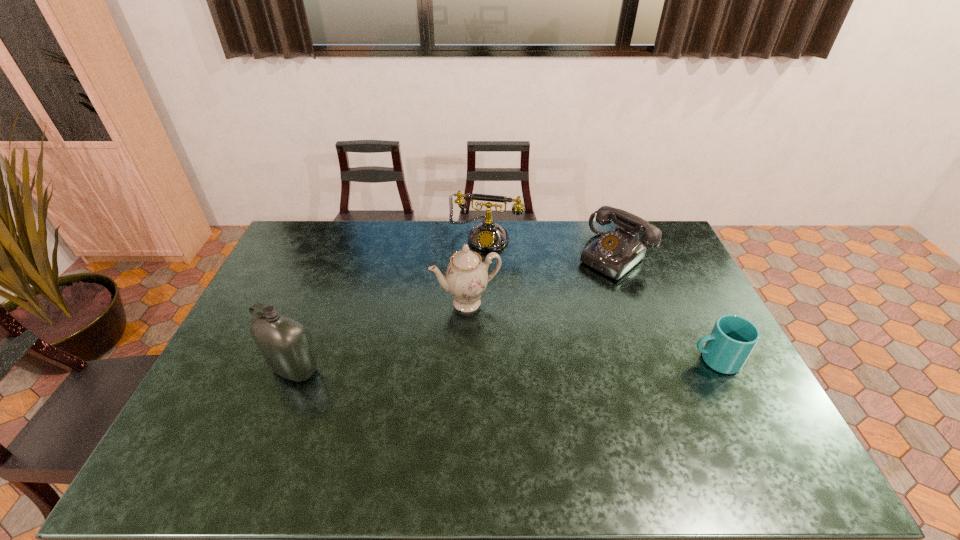
Locate an element on the screen. The height and width of the screenshot is (540, 960). bottle is located at coordinates (284, 342).

Where is `the shortest object`? The image size is (960, 540). the shortest object is located at coordinates (732, 339).

Locate an element on the screen. The width and height of the screenshot is (960, 540). the third farthest object is located at coordinates (466, 277).

The image size is (960, 540). Find the location of `the shorter telephone`. the shorter telephone is located at coordinates (614, 253).

Find the location of `the right telephone`. the right telephone is located at coordinates (614, 253).

Where is `the taller telephone`? The width and height of the screenshot is (960, 540). the taller telephone is located at coordinates [487, 236].

Identify the location of the third tallest object. The image size is (960, 540). [x=487, y=236].

You are a GUI agent. You are given a task and a screenshot of the screen. Output one action in this format:
    pyautogui.click(x=<x>, y=<y>)
    Task: Click on the vacant region located on the front of the leftmost object
    Image resolution: width=960 pixels, height=540 pixels.
    Given the screenshot: What is the action you would take?
    pyautogui.click(x=274, y=422)

I want to click on free space located 0.360m on the handle side of the cup, so click(563, 360).

Locate an element on the screen. The width and height of the screenshot is (960, 540). vacant space located on the handle side of the cup is located at coordinates (566, 360).